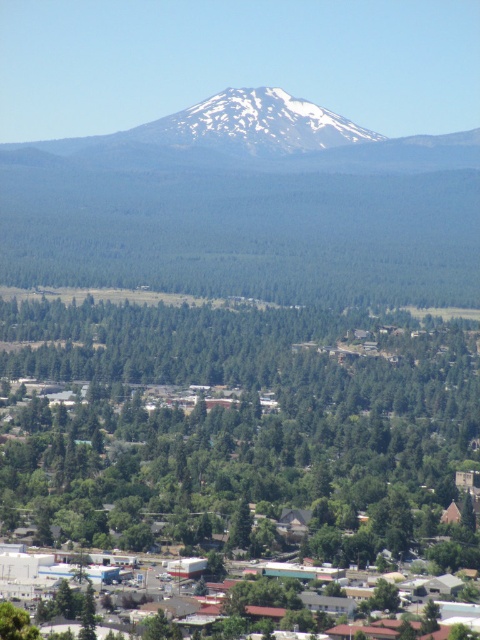
Question: Which of the following is the farthest from the observer?

Choices:
 (A) (164, 140)
 (B) (235, 369)

Answer: (A)

Question: Which point appears farthest from the camera in this image?

Choices:
 (A) (154, 381)
 (B) (178, 132)

Answer: (B)

Question: Is green leafy trees at center positioned behind white snow-capped mountain at upper center?

Choices:
 (A) yes
 (B) no

Answer: (B)

Question: Which point is farther to the camera?

Choices:
 (A) (294, 140)
 (B) (78, 332)

Answer: (A)

Question: Can you confirm if green leafy trees at center is wider than white snow-capped mountain at upper center?

Choices:
 (A) yes
 (B) no

Answer: (A)

Question: Is green leafy trees at center thinner than white snow-capped mountain at upper center?

Choices:
 (A) yes
 (B) no

Answer: (B)